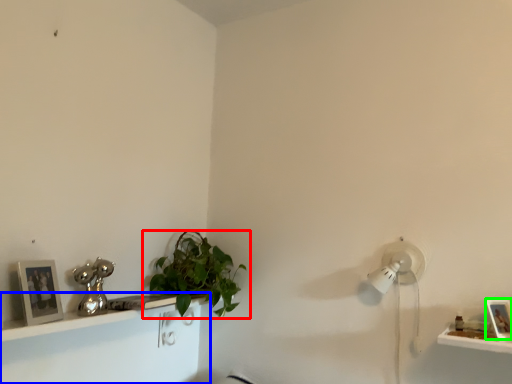
Question: Estimate the real-world distances between objects in this image. Which object is farther from houseplant (highlighted by a red box), shelf (highlighted by a blue box) or picture frame (highlighted by a green box)?

Choices:
 (A) shelf
 (B) picture frame

Answer: (B)